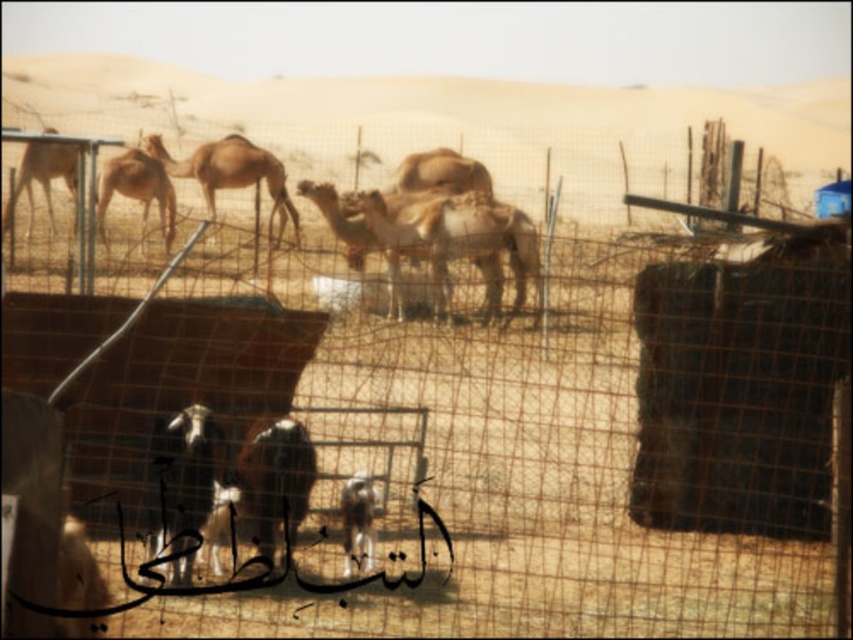
Does brown sandy dirt field at center have a lesser width compared to brown fuzzy goat at center?

No.

Does point (479, 131) lie in front of point (346, 536)?

No, (479, 131) is behind (346, 536).

Identify the location of brown sandy dirt field at center. (453, 112).

Is point (798, 132) less distant than point (242, 172)?

That is False.

Can you confirm if brown sandy dirt field at center is thinner than brown textured camel at center?

In fact, brown sandy dirt field at center might be wider than brown textured camel at center.

Does point (647, 108) lie behind point (279, 204)?

Yes, it is behind point (279, 204).

Locate an element on the screen. The height and width of the screenshot is (640, 853). brown sandy dirt field at center is located at coordinates (453, 112).

Who is more distant from viewer, (248, 512) or (131, 188)?

The point (131, 188) is more distant.

Consider the image. Can you confirm if brown fuzzy bird at center is thinner than light brown fur camel at left?

Yes.

I want to click on brown fuzzy bird at center, so click(274, 483).

This screenshot has width=853, height=640. I want to click on brown fuzzy bird at center, so click(274, 483).